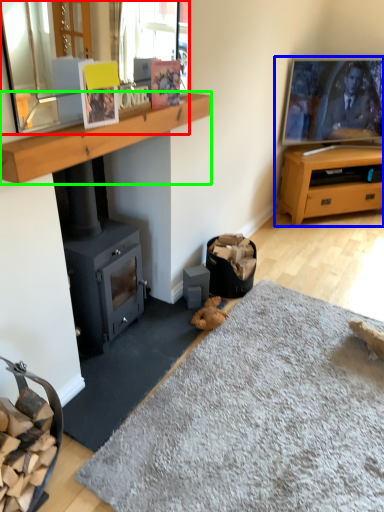
Question: Which object is the closest to the mirror (highlighted by a red box)? Choose among these: entertainment center (highlighted by a blue box) or mantle (highlighted by a green box).

Choices:
 (A) entertainment center
 (B) mantle

Answer: (B)